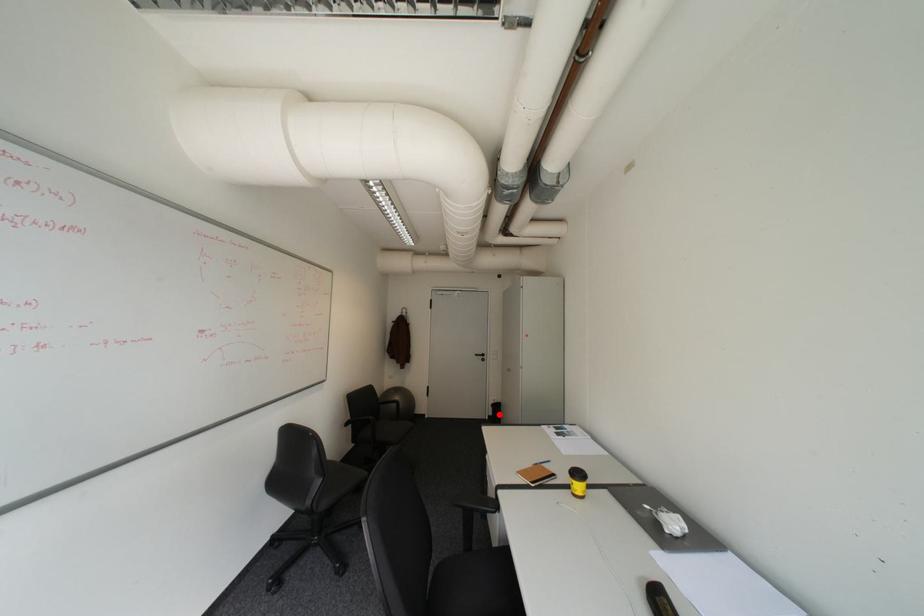
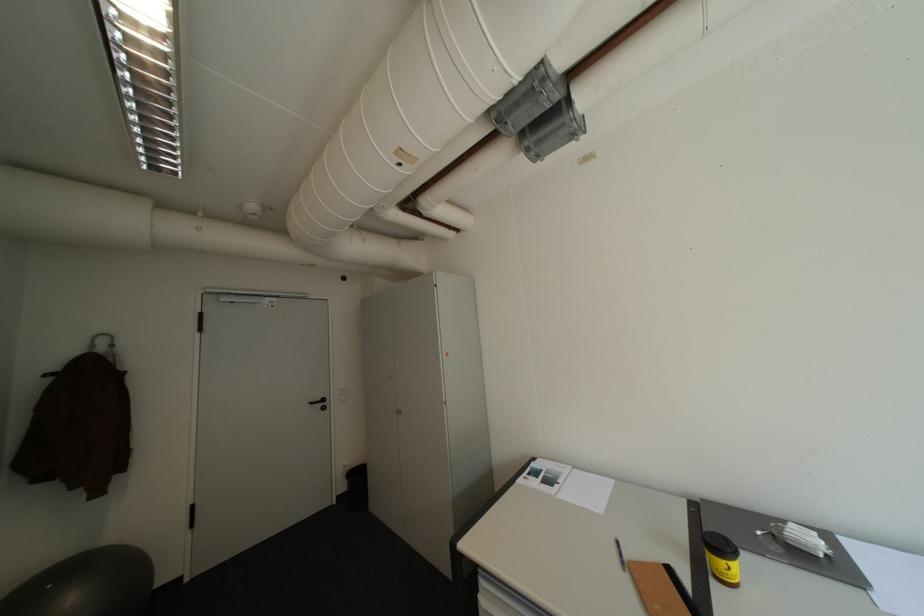
Locate, in the second image, the point that corresponds to the highlighted location in the first image.

(347, 493)